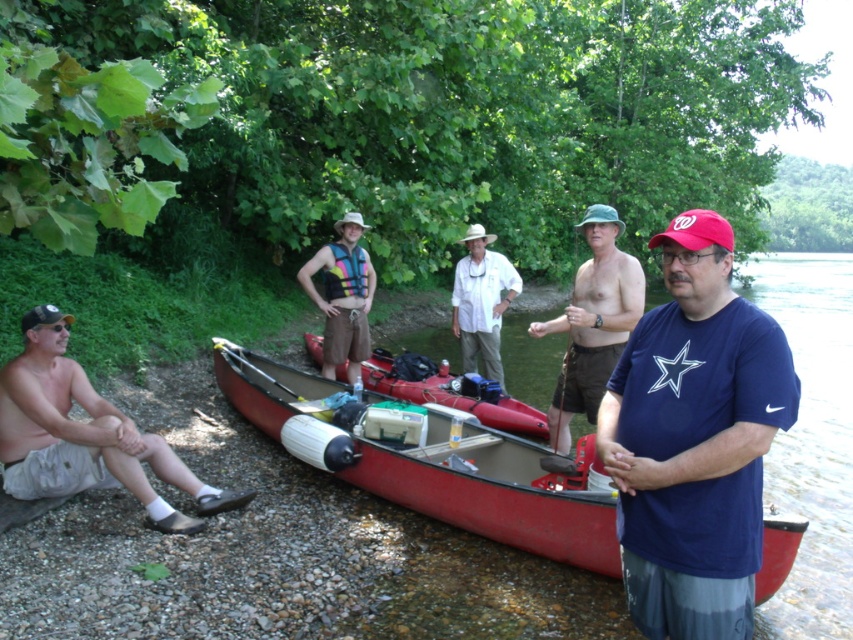
You are standing at the edge of the water and notice the green fabric hat at center. Can you determine if the hat is closer to the red canoe resting on the shore or to the edge of the water where you are standing?

The green fabric hat at center is located at point (593, 323). Since the red canoe is resting on the shore and the hat is at the center, it is closer to the edge of the water where you are standing compared to the red canoe.